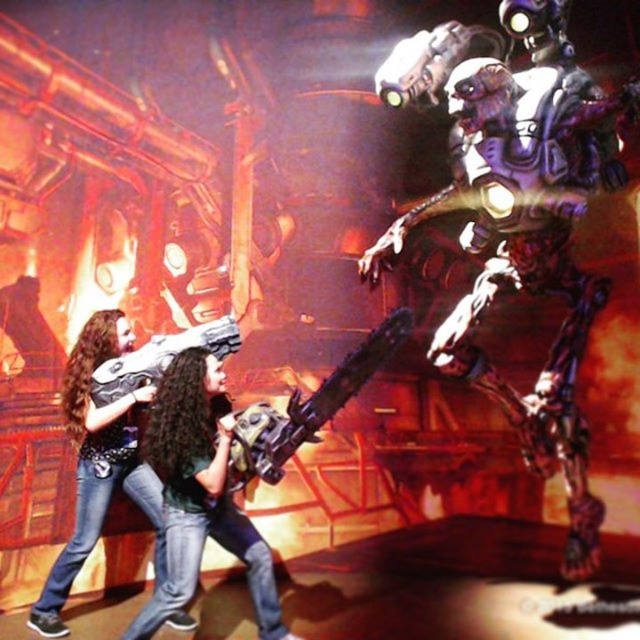
You are a maintenance worker in this facility. You need to safely store both the metallic purple robot at center and the matte black chainsaw at center in a storage locker. The locker has a maximum size limit. Which object should you store first to ensure both fit?

The metallic purple robot at center is bigger than the matte black chainsaw at center, so you should store the metallic purple robot at center first to ensure both fit within the locker.

You are a character in this sci fi scene. You need to grab a weapon to fight the robot. The metallic chainsaw at center and the matte black gun at lower left are available. Which weapon is taller so you can reach the robot more easily?

The metallic chainsaw at center is taller than the matte black gun at lower left, so it would allow you to reach the robot more easily.